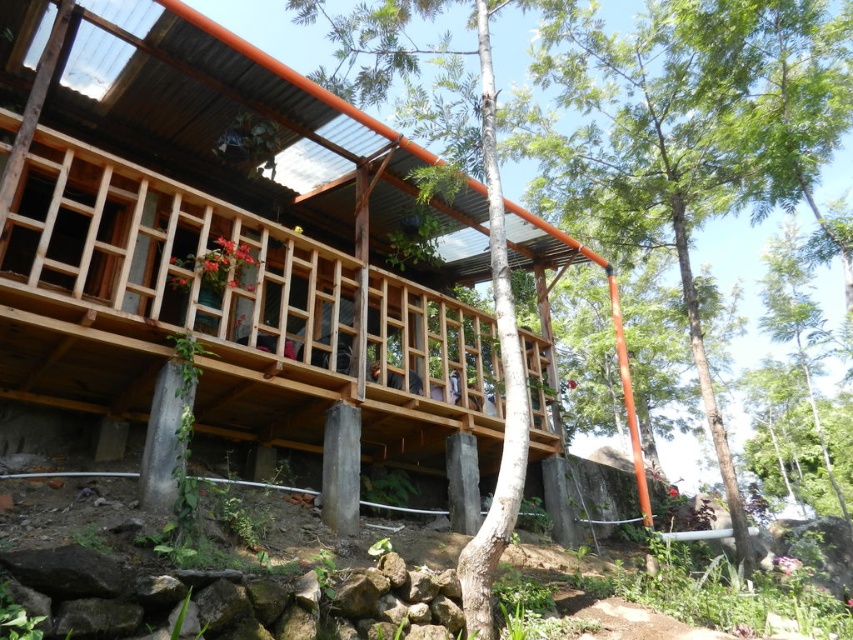
Question: Among these objects, which one is nearest to the camera?

Choices:
 (A) green leafy tree at center
 (B) wooden deck at center

Answer: (B)

Question: Which of the following is the farthest from the observer?

Choices:
 (A) (216, 333)
 (B) (612, 236)

Answer: (B)

Question: Can you confirm if wooden deck at center is positioned to the right of green leafy tree at center?

Choices:
 (A) yes
 (B) no

Answer: (B)

Question: Is wooden deck at center to the left of green leafy tree at center from the viewer's perspective?

Choices:
 (A) no
 (B) yes

Answer: (B)

Question: Is wooden deck at center positioned at the back of green leafy tree at center?

Choices:
 (A) yes
 (B) no

Answer: (B)